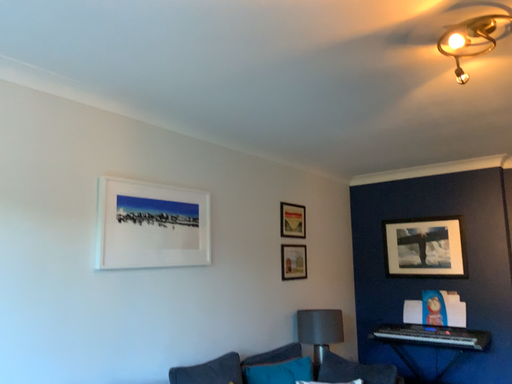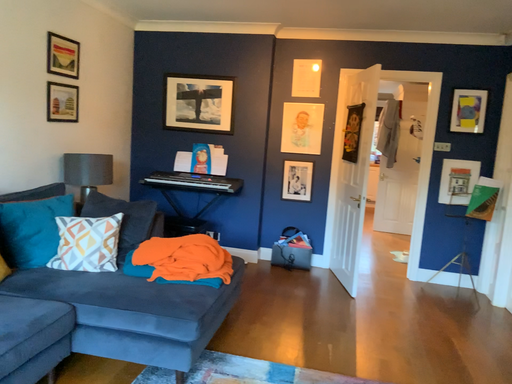
Question: Which way did the camera rotate in the video?

Choices:
 (A) rotated right
 (B) rotated left

Answer: (A)